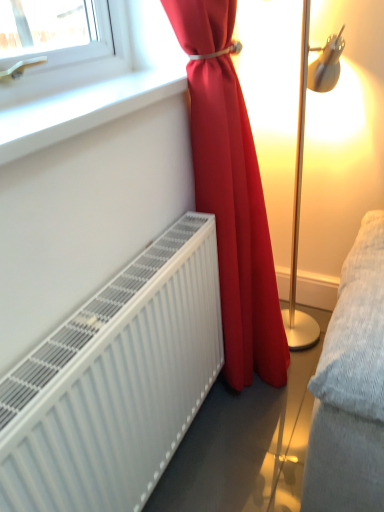
The height and width of the screenshot is (512, 384). In order to click on vacant area that is in front of matte red curtain at center in this screenshot , I will do point(251,465).